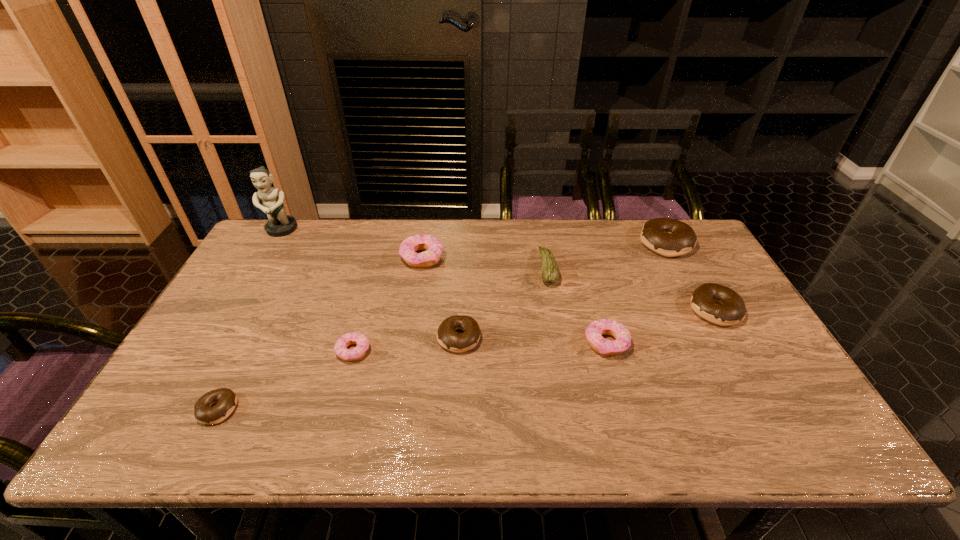
Where is `vacant space located at the stem end of the green zucchini`? Image resolution: width=960 pixels, height=540 pixels. vacant space located at the stem end of the green zucchini is located at coordinates (432, 268).

At what (x,y) coordinates should I click in order to perform the action: click on vacant space located at the stem end of the green zucchini. Please return your answer as a coordinate pair (x, y). The height and width of the screenshot is (540, 960). Looking at the image, I should click on (429, 268).

Identify the location of vacant region located 0.210m on the left of the biggest pink doughnut. This screenshot has height=540, width=960. (336, 258).

I want to click on vacant space situated on the front of the second biggest brown doughnut, so pyautogui.click(x=757, y=384).

You are a GUI agent. You are given a task and a screenshot of the screen. Output one action in this format:
    pyautogui.click(x=<x>, y=<y>)
    Task: Click on the free space located on the front of the second biggest pink doughnut
    
    Given the screenshot: What is the action you would take?
    pyautogui.click(x=624, y=404)

What are the coordinates of `free space located 0.110m on the right of the fourth doughnut from right to left` in the screenshot? It's located at (521, 338).

The width and height of the screenshot is (960, 540). I want to click on free space located on the front of the leftmost pink doughnut, so click(x=330, y=434).

Locate an element on the screen. The height and width of the screenshot is (540, 960). vacant space positioned 0.310m on the right of the nearest doughnut is located at coordinates (371, 409).

The image size is (960, 540). I want to click on figurine that is at the far edge, so click(279, 224).

Locate an element on the screen. zucchini positioned at the far edge is located at coordinates (550, 273).